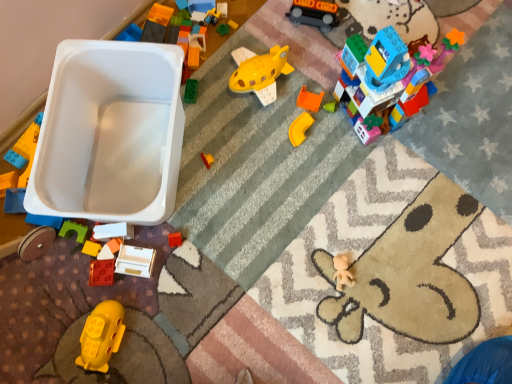
Question: Is shiny black train at upper center, the eighth toy ordered from the bottom, inside or outside of yellow matte toy submarine at lower left, the 6th toy viewed from the right?

Choices:
 (A) inside
 (B) outside

Answer: (B)

Question: In terms of width, does shiny black train at upper center, which ranks as the 2th toy in right-to-left order, look wider or thinner when compared to yellow matte toy submarine at lower left, which is the 3th toy from left to right?

Choices:
 (A) wide
 (B) thin

Answer: (A)

Question: Which object is positioned farthest from the yellow matte plastic corner piece at center-right, acting as the third toy starting from the right?

Choices:
 (A) yellow matte toy submarine at lower left, which is the 3th toy from left to right
 (B) rubberized orange block at lower left, the 1th toy positioned from the left
 (C) white matte block at lower left, arranged as the fifth toy when ordered from the bottom
 (D) shiny black train at upper center, which ranks as the 2th toy in right-to-left order
 (E) multicolored plastic building block at upper right, which appears as the seventh toy when ordered from the bottom

Answer: (A)

Question: Based on their relative distances, which object is farther from the yellow matte plastic corner piece at center-right, acting as the third toy starting from the right?

Choices:
 (A) matte white drawer at lower center, which is counted as the 5th toy, starting from the left
 (B) rubber brick at lower left, the second toy positioned from the bottom
 (C) rubberized orange block at lower left, positioned as the eighth toy in right-to-left order
 (D) multicolored plastic building block at upper right, the first toy when ordered from right to left
 (E) yellow matte toy submarine at lower left, which is the first toy from bottom to top

Answer: (E)